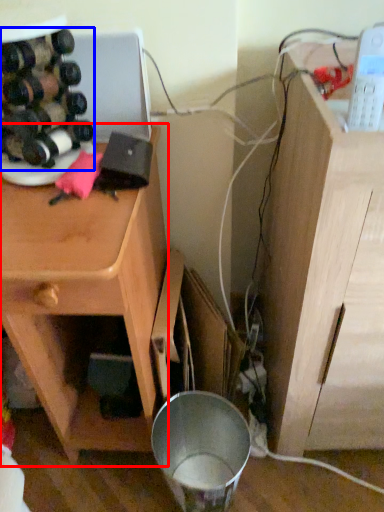
Question: Which object appears farthest to the camera in this image, cabinetry (highlighted by a red box) or wine bottle (highlighted by a blue box)?

Choices:
 (A) cabinetry
 (B) wine bottle

Answer: (B)